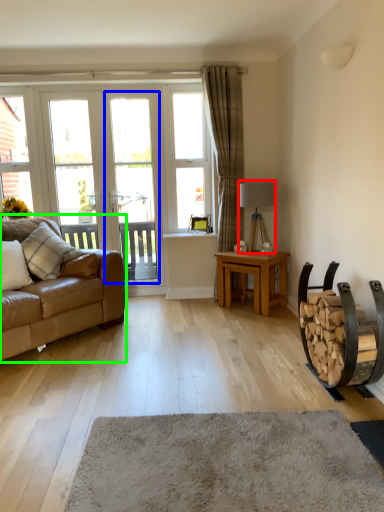
Question: Which object is the closest to the lamp (highlighted by a red box)? Choose among these: screen door (highlighted by a blue box) or studio couch (highlighted by a green box).

Choices:
 (A) screen door
 (B) studio couch

Answer: (A)